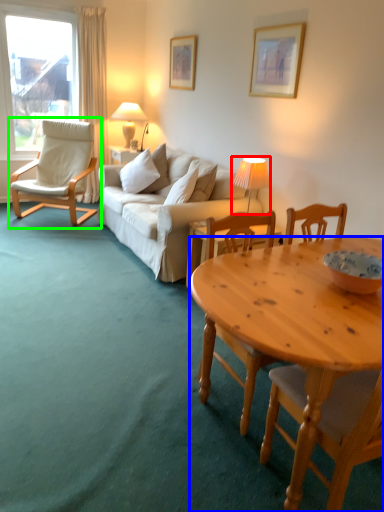
Question: Considering the real-world distances, which object is closest to lamp (highlighted by a red box)? desk (highlighted by a blue box) or chair (highlighted by a green box).

Choices:
 (A) desk
 (B) chair

Answer: (A)